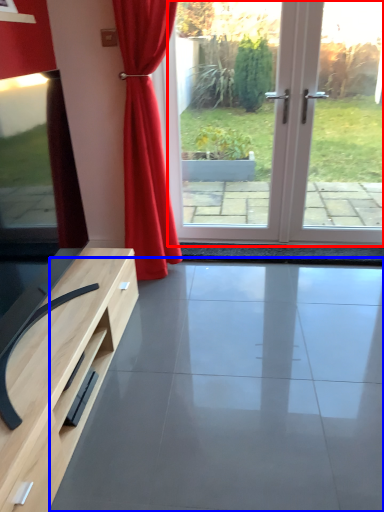
Question: Which point is further to the camera, screen door (highlighted by a red box) or concrete (highlighted by a blue box)?

Choices:
 (A) screen door
 (B) concrete

Answer: (A)